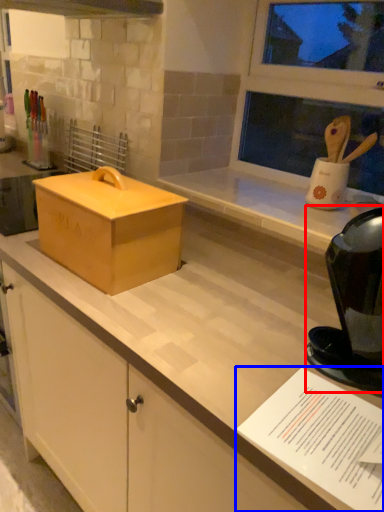
Question: Which of the following is the farthest to the observer, appliance (highlighted by a red box) or paper (highlighted by a blue box)?

Choices:
 (A) appliance
 (B) paper

Answer: (A)